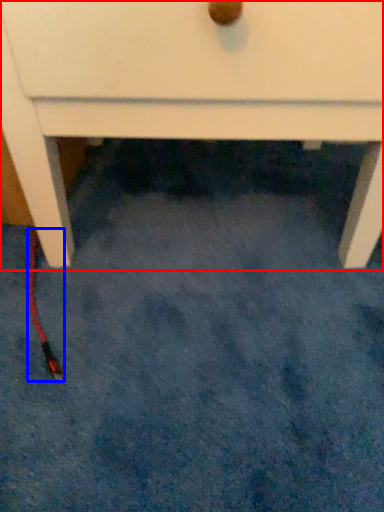
Question: Which of the following is the farthest to the observer, chest of drawers (highlighted by a red box) or cable (highlighted by a blue box)?

Choices:
 (A) chest of drawers
 (B) cable

Answer: (B)